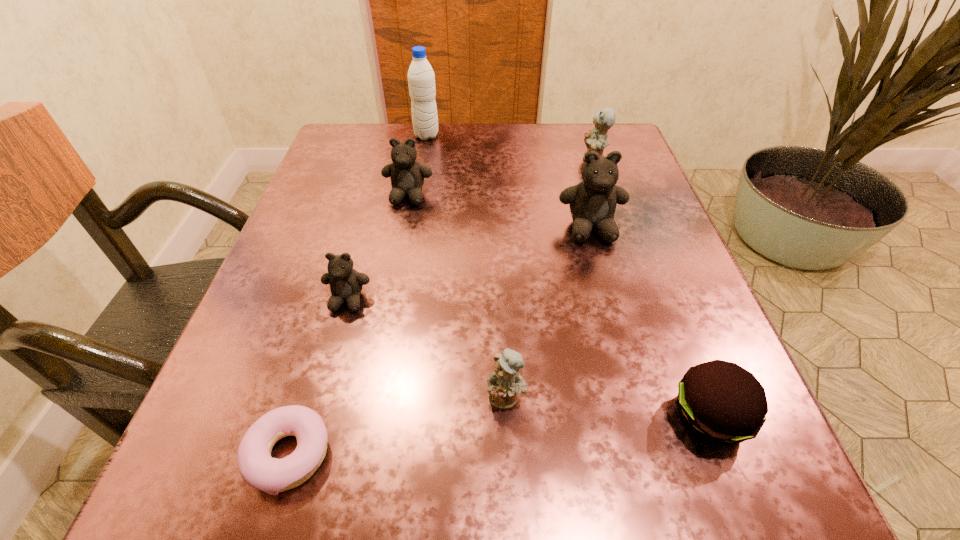
Where is `patty at the right edge`? This screenshot has width=960, height=540. patty at the right edge is located at coordinates (720, 402).

Locate an element on the screen. This screenshot has width=960, height=540. object that is positioned at the near left corner is located at coordinates (258, 469).

At what (x,y) coordinates should I click in order to perform the action: click on object at the far right corner. Please return your answer as a coordinate pair (x, y). Looking at the image, I should click on (596, 140).

Where is `object that is at the near right corner`? Image resolution: width=960 pixels, height=540 pixels. object that is at the near right corner is located at coordinates (720, 402).

Where is `free location at the far edge`? The width and height of the screenshot is (960, 540). free location at the far edge is located at coordinates [557, 157].

This screenshot has width=960, height=540. In the image, there is a desktop. What are the coordinates of `blank space at the near edge` in the screenshot? It's located at (531, 491).

Image resolution: width=960 pixels, height=540 pixels. In the image, there is a desktop. Find the location of `vacant region at the left edge`. vacant region at the left edge is located at coordinates click(343, 208).

In the image, there is a desktop. Where is `vacant region at the right edge`? vacant region at the right edge is located at coordinates (646, 183).

At what (x,y) coordinates should I click in order to perform the action: click on free location at the far left corner. Please return your answer as a coordinate pair (x, y). Looking at the image, I should click on (x=368, y=153).

In the image, there is a desktop. Find the location of `vacant space at the near left corner`. vacant space at the near left corner is located at coordinates (238, 501).